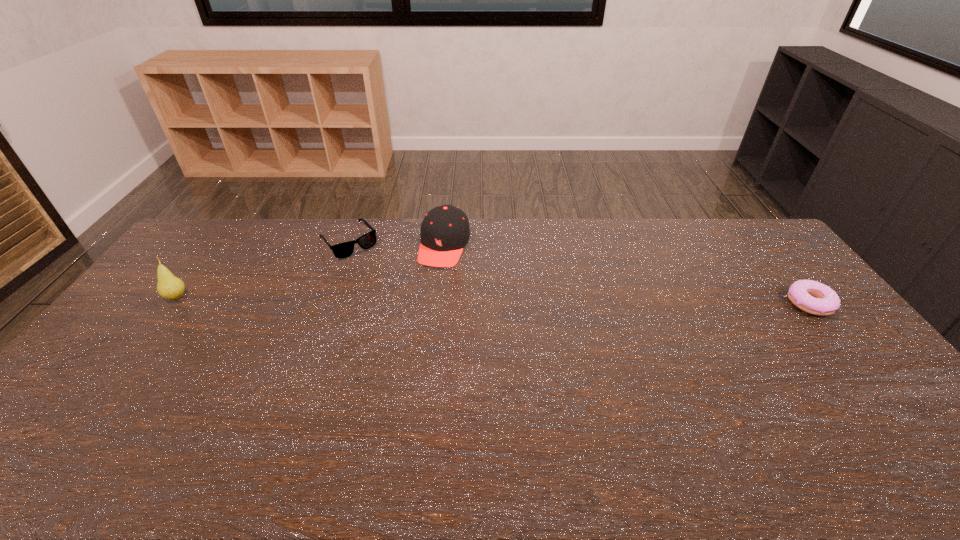
The height and width of the screenshot is (540, 960). I want to click on vacant space on the desktop that is between the pear and the rightmost object and is positioned on the front-facing side of the cap, so click(x=423, y=300).

Find the location of a particular element. free spot on the desktop that is between the leftmost object and the rightmost object and is positioned on the front-facing side of the sunglasses is located at coordinates (400, 300).